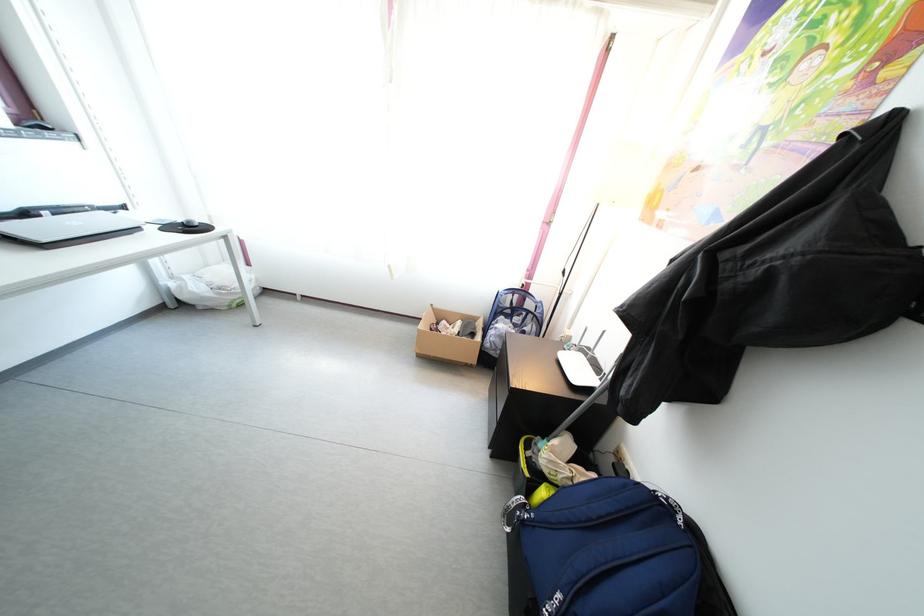
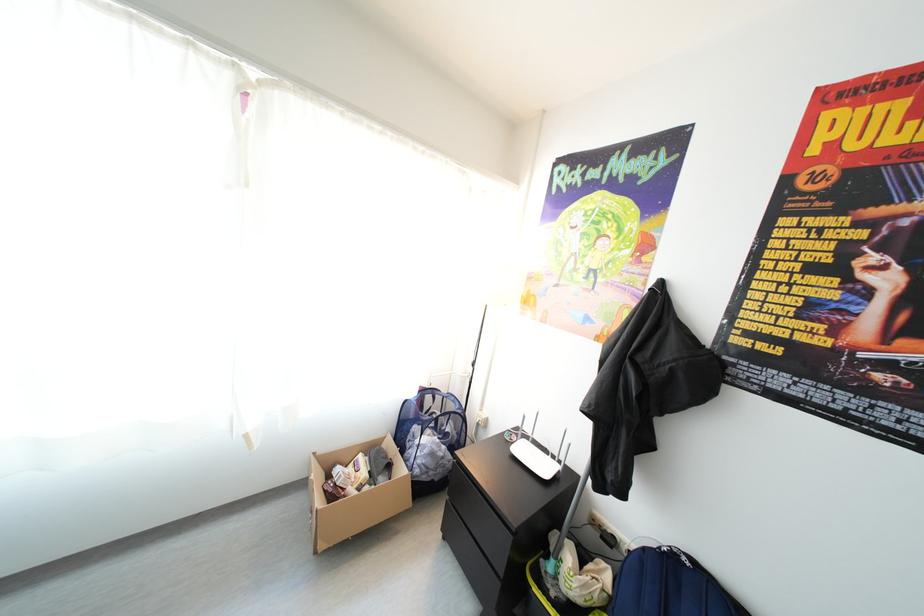
Question: How did the camera likely rotate?

Choices:
 (A) Left
 (B) Right
 (C) Up
 (D) Down

Answer: (B)